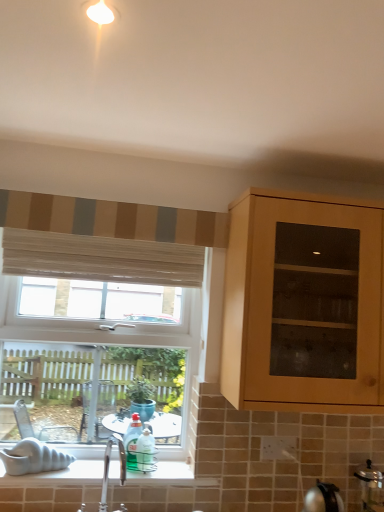
Question: Is wooden blinds at upper left, acting as the 1th curtain starting from the bottom, located outside satin silver pressure cooker at lower right?

Choices:
 (A) yes
 (B) no

Answer: (A)

Question: From a real-world perspective, is wooden blinds at upper left, the second curtain viewed from the top, physically below satin silver pressure cooker at lower right?

Choices:
 (A) no
 (B) yes

Answer: (A)

Question: Is wooden blinds at upper left, the second curtain viewed from the top, oriented away from satin silver pressure cooker at lower right?

Choices:
 (A) no
 (B) yes

Answer: (A)

Question: Is wooden blinds at upper left, acting as the 1th curtain starting from the bottom, in front of satin silver pressure cooker at lower right?

Choices:
 (A) yes
 (B) no

Answer: (B)

Question: Considering the relative positions of wooden blinds at upper left, the second curtain viewed from the top, and satin silver pressure cooker at lower right in the image provided, is wooden blinds at upper left, the second curtain viewed from the top, to the left of satin silver pressure cooker at lower right from the viewer's perspective?

Choices:
 (A) no
 (B) yes

Answer: (B)

Question: Looking at their shapes, would you say satin silver pressure cooker at lower right is wider or thinner than polished chrome tap at lower center?

Choices:
 (A) wide
 (B) thin

Answer: (A)

Question: Would you say satin silver pressure cooker at lower right is to the left or to the right of polished chrome tap at lower center in the picture?

Choices:
 (A) right
 (B) left

Answer: (A)

Question: Does point (360, 477) appear closer or farther from the camera than point (119, 510)?

Choices:
 (A) closer
 (B) farther

Answer: (B)

Question: Considering the positions of satin silver pressure cooker at lower right and polished chrome tap at lower center in the image, is satin silver pressure cooker at lower right taller or shorter than polished chrome tap at lower center?

Choices:
 (A) tall
 (B) short

Answer: (B)

Question: In terms of height, does wooden blinds at upper left, acting as the 1th curtain starting from the bottom, look taller or shorter compared to satin silver pressure cooker at lower right?

Choices:
 (A) short
 (B) tall

Answer: (A)

Question: From the image's perspective, is wooden blinds at upper left, the second curtain viewed from the top, positioned above or below satin silver pressure cooker at lower right?

Choices:
 (A) below
 (B) above

Answer: (B)

Question: Does point (41, 261) appear closer or farther from the camera than point (369, 476)?

Choices:
 (A) closer
 (B) farther

Answer: (B)

Question: From a real-world perspective, is wooden blinds at upper left, acting as the 1th curtain starting from the bottom, physically located above or below satin silver pressure cooker at lower right?

Choices:
 (A) above
 (B) below

Answer: (A)

Question: Is polished chrome tap at lower center wider or thinner than wooden blinds at upper left, acting as the 1th curtain starting from the bottom?

Choices:
 (A) thin
 (B) wide

Answer: (B)

Question: Is polished chrome tap at lower center to the left or to the right of wooden blinds at upper left, acting as the 1th curtain starting from the bottom, in the image?

Choices:
 (A) left
 (B) right

Answer: (B)